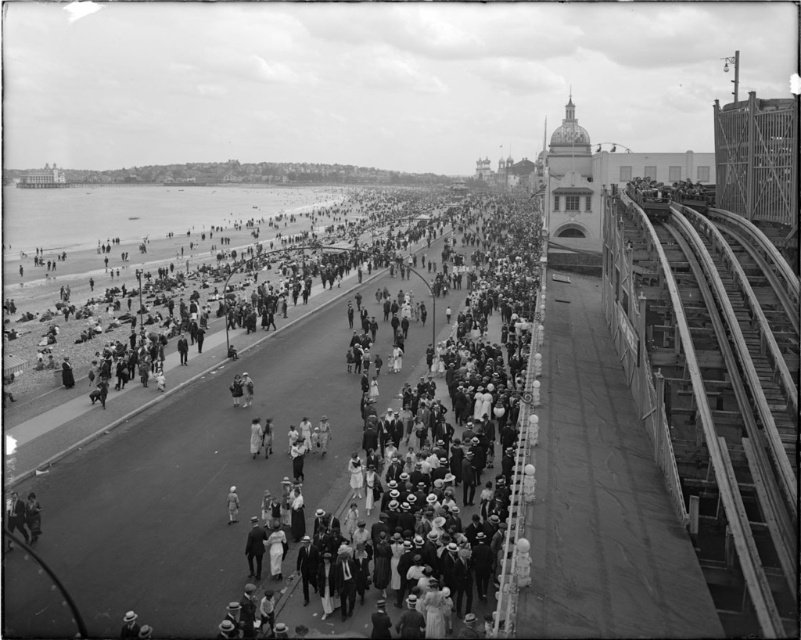
Is white cotton dress at center thinner than smooth metal train track at right?

In fact, white cotton dress at center might be wider than smooth metal train track at right.

Locate an element on the screen. white cotton dress at center is located at coordinates (304, 452).

Is point (498, 294) less distant than point (638, 278)?

That is False.

Locate an element on the screen. white cotton dress at center is located at coordinates (304, 452).